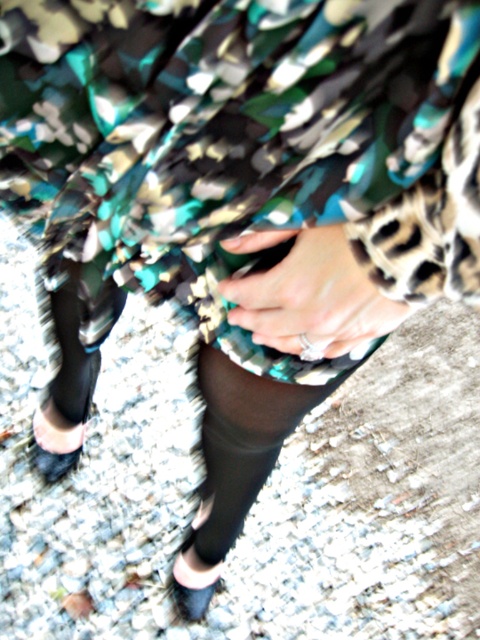
From the picture: Can you confirm if black sheer sock at lower center is positioned to the right of black suede shoe at lower center?

Yes, black sheer sock at lower center is to the right of black suede shoe at lower center.

Is black sheer sock at lower center wider than black suede shoe at lower center?

Yes, black sheer sock at lower center is wider than black suede shoe at lower center.

Find the location of `black sheer sock at lower center`. black sheer sock at lower center is located at coordinates (230, 477).

Can you confirm if printed fabric dress at center is positioned above black sheer sock at lower center?

Correct, printed fabric dress at center is located above black sheer sock at lower center.

Is point (396, 248) farther from viewer compared to point (248, 490)?

No, (396, 248) is closer to viewer.

Find the location of a particular element. printed fabric dress at center is located at coordinates (218, 136).

Who is taller, black leather shoe at lower left or black suede shoe at lower center?

black leather shoe at lower left is taller.

Can you confirm if black leather shoe at lower left is shorter than black suede shoe at lower center?

No.

Between point (50, 465) and point (204, 608), which one is positioned in front?

Positioned in front is point (204, 608).

Locate an element on the screen. black leather shoe at lower left is located at coordinates (55, 442).